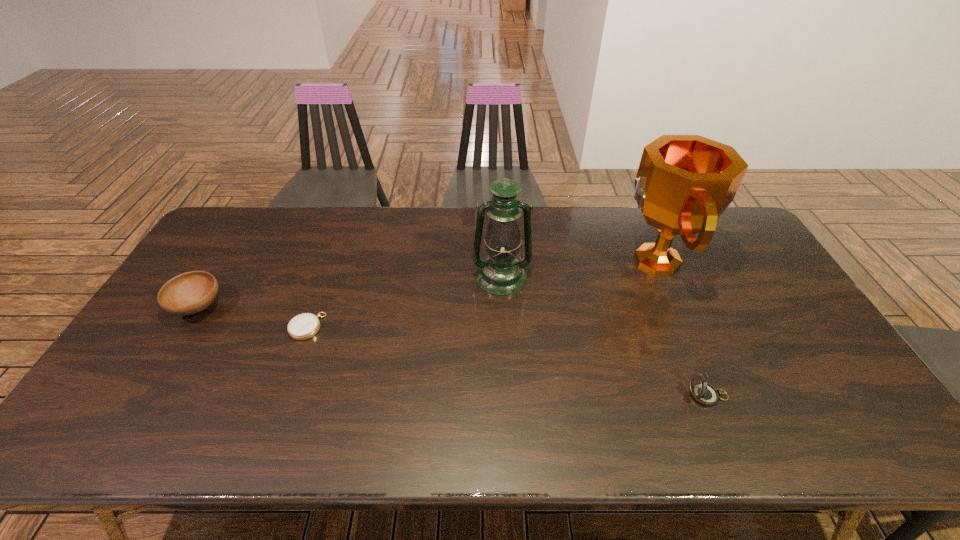
The width and height of the screenshot is (960, 540). In the image, there is a desktop. What are the coordinates of `vacant space at the right edge` in the screenshot? It's located at (762, 267).

You are a GUI agent. You are given a task and a screenshot of the screen. Output one action in this format:
    pyautogui.click(x=<x>, y=<y>)
    Task: Click on the vacant area that lies between the third object from right to left and the shortest object
    This screenshot has height=540, width=960.
    Given the screenshot: What is the action you would take?
    pyautogui.click(x=404, y=302)

The width and height of the screenshot is (960, 540). I want to click on vacant space that's between the shorter compass and the leftmost object, so click(252, 317).

Where is `vacant area that lies between the leftmost object and the oil lamp`? This screenshot has width=960, height=540. vacant area that lies between the leftmost object and the oil lamp is located at coordinates click(x=350, y=292).

Find the location of `free area in between the third object from right to left and the left compass`. free area in between the third object from right to left and the left compass is located at coordinates (404, 302).

You are a GUI agent. You are given a task and a screenshot of the screen. Output one action in this format:
    pyautogui.click(x=<x>, y=<y>)
    Task: Click on the free space between the left compass and the leftmost object
    Image resolution: width=960 pixels, height=540 pixels.
    Given the screenshot: What is the action you would take?
    pyautogui.click(x=252, y=317)

You are a GUI agent. You are given a task and a screenshot of the screen. Output one action in this format:
    pyautogui.click(x=<x>, y=<y>)
    Task: Click on the vacant space that is in between the taller compass and the oil lamp
    This screenshot has height=540, width=960.
    Given the screenshot: What is the action you would take?
    pyautogui.click(x=605, y=336)

Identify the location of unoccupied position between the right compass and the second object from left to right. The height and width of the screenshot is (540, 960). (508, 361).

Locate an element on the screen. vacant area that lies between the third object from left to right and the leftmost object is located at coordinates (350, 292).

I want to click on free spot between the nearer compass and the award, so click(x=682, y=328).